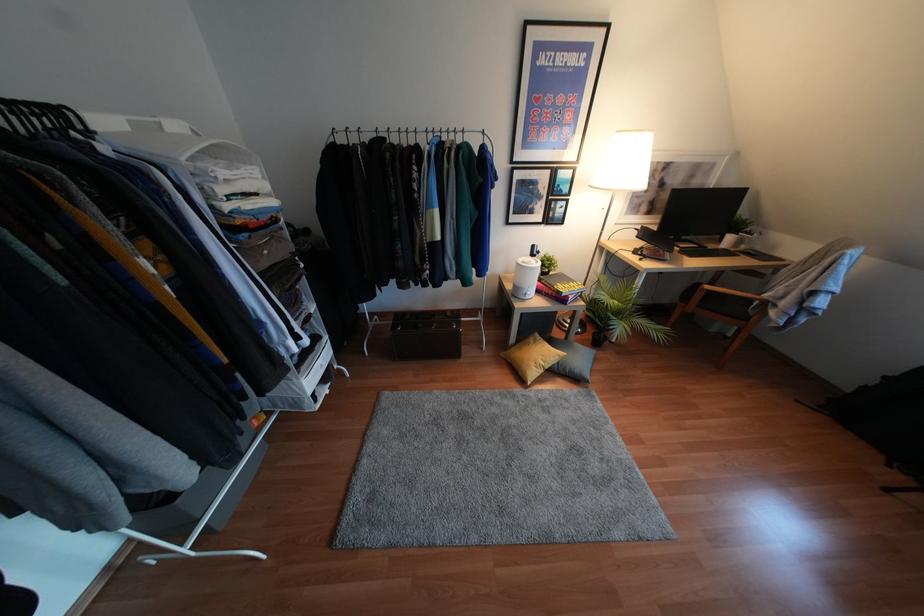
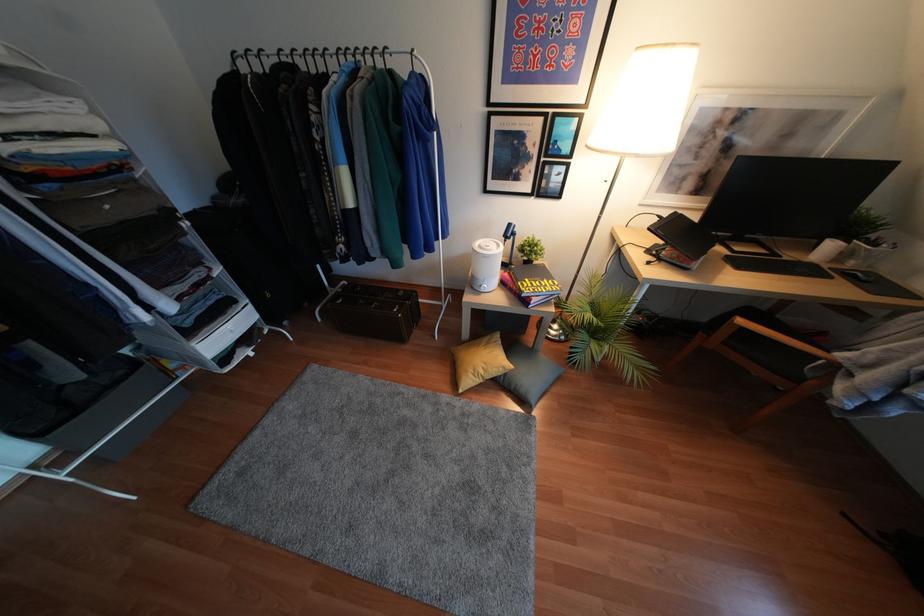
Question: The camera is either moving clockwise (left) or counter-clockwise (right) around the object. The first image is from the beginning of the video and the second image is from the end. Is the camera moving left or right when shooting the video?

Choices:
 (A) Left
 (B) Right

Answer: (B)